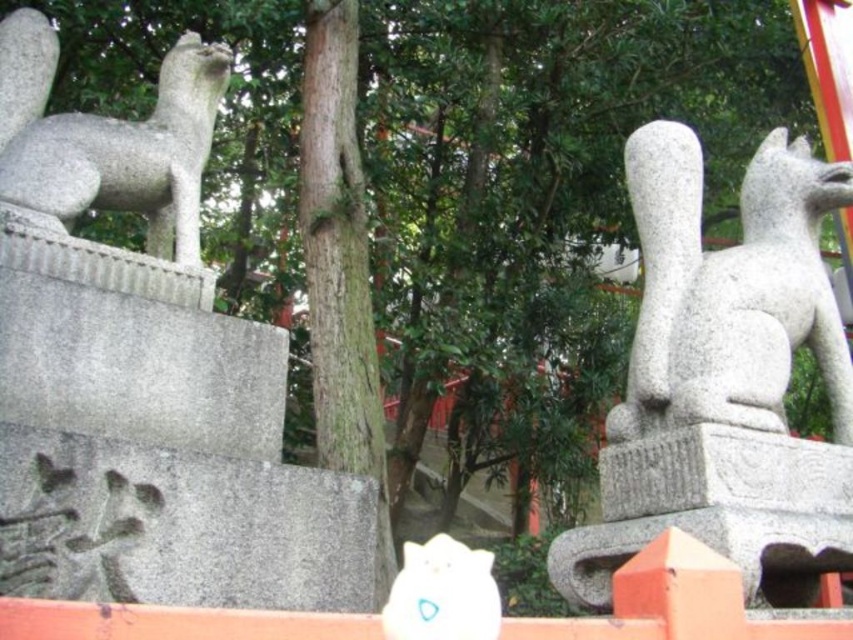
You are visiting a Shinto shrine and notice the gray stone statue at left and the white plush toy at center. Which object is taller?

The white plush toy at center is taller than the gray stone statue at left.